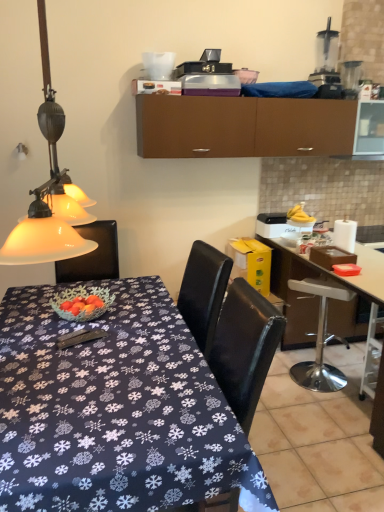
Where is `matte glass lampshade at left`? matte glass lampshade at left is located at coordinates (48, 190).

Where is `metallic silver bar stool at lower right`? The width and height of the screenshot is (384, 512). metallic silver bar stool at lower right is located at coordinates (371, 354).

Locate an element on the screen. This screenshot has height=512, width=384. dark blue fabric table at center, which is the second desk in right-to-left order is located at coordinates (115, 410).

This screenshot has height=512, width=384. What are the coordinates of `matte glass lampshade at left` in the screenshot? It's located at (48, 190).

Can you confirm if brown matte cabinet at upper center is thinner than transparent plastic blender at upper right, the 2th appliance from the right?

No.

Could you tell me if brown matte cabinet at upper center is facing transparent plastic blender at upper right, arranged as the first appliance when viewed from the left?

No, brown matte cabinet at upper center does not turn towards transparent plastic blender at upper right, arranged as the first appliance when viewed from the left.

From the image's perspective, between brown matte cabinet at upper center and transparent plastic blender at upper right, arranged as the first appliance when viewed from the left, who is located below?

From the image's view, brown matte cabinet at upper center is below.

Could transparent plastic blender at upper right, arranged as the first appliance when viewed from the left, be considered to be inside brown matte cabinet at upper center?

No, transparent plastic blender at upper right, arranged as the first appliance when viewed from the left, is not surrounded by brown matte cabinet at upper center.

What's the angular difference between matte glass lampshade at left and transparent plastic blender at upper right, arranged as the first appliance when viewed from the left,'s facing directions?

They differ by 85.1 degrees in their facing directions.

Between matte glass lampshade at left and transparent plastic blender at upper right, the 2th appliance from the right, which one appears on the right side from the viewer's perspective?

Positioned to the right is transparent plastic blender at upper right, the 2th appliance from the right.

From the image's perspective, who appears lower, matte glass lampshade at left or transparent plastic blender at upper right, the 2th appliance from the right?

matte glass lampshade at left.

Is white glossy desk at right, which is the 2th desk from left to right, looking in the opposite direction of transparent plastic blender at upper right, arranged as the first appliance when viewed from the left?

No.

How different are the orientations of white glossy desk at right, arranged as the 1th desk when viewed from the right, and transparent plastic blender at upper right, the 2th appliance from the right, in degrees?

There is a 92.4-degree angle between the facing directions of white glossy desk at right, arranged as the 1th desk when viewed from the right, and transparent plastic blender at upper right, the 2th appliance from the right.

Is white glossy desk at right, arranged as the 1th desk when viewed from the right, not near transparent plastic blender at upper right, arranged as the first appliance when viewed from the left?

Yes, white glossy desk at right, arranged as the 1th desk when viewed from the right, and transparent plastic blender at upper right, arranged as the first appliance when viewed from the left, are located far from each other.

Between white glossy desk at right, which is the 2th desk from left to right, and transparent plastic blender at upper right, the 2th appliance from the right, which one is positioned in front?

white glossy desk at right, which is the 2th desk from left to right, is in front.

From the image's perspective, between matte glass lampshade at left and brown matte cabinet at upper center, which one is located above?

brown matte cabinet at upper center.

From the picture: Is brown matte cabinet at upper center surrounded by matte glass lampshade at left?

That's incorrect, brown matte cabinet at upper center is not inside matte glass lampshade at left.

Which object is more forward, matte glass lampshade at left or brown matte cabinet at upper center?

matte glass lampshade at left is in front.

Where is `lamp in front of the brown matte cabinet at upper center`? The width and height of the screenshot is (384, 512). lamp in front of the brown matte cabinet at upper center is located at coordinates (48, 190).

Is the depth of transparent plastic blender at upper right, the second appliance viewed from the left, greater than that of white glossy desk at right, arranged as the 1th desk when viewed from the right?

Yes, it is behind white glossy desk at right, arranged as the 1th desk when viewed from the right.

At what (x,y) coordinates should I click in order to perform the action: click on the 2nd appliance behind when counting from the white glossy desk at right, arranged as the 1th desk when viewed from the right. Please return your answer as a coordinate pair (x, y). Looking at the image, I should click on (350, 78).

Between transparent plastic blender at upper right, arranged as the first appliance when viewed from the right, and white glossy desk at right, which is the 2th desk from left to right, which one appears on the right side from the viewer's perspective?

From the viewer's perspective, white glossy desk at right, which is the 2th desk from left to right, appears more on the right side.

Considering the positions of point (348, 78) and point (370, 251), is point (348, 78) closer or farther from the camera than point (370, 251)?

Point (348, 78) appears to be farther away from the viewer than point (370, 251).

Which of these two, transparent plastic blender at upper right, the 2th appliance from the right, or dark blue fabric table at center, which is the second desk in right-to-left order, is bigger?

Bigger between the two is dark blue fabric table at center, which is the second desk in right-to-left order.

From a real-world perspective, starting from the transparent plastic blender at upper right, arranged as the first appliance when viewed from the left, which desk is the 2nd one below it? Please provide its 2D coordinates.

[(115, 410)]

From a real-world perspective, is transparent plastic blender at upper right, arranged as the first appliance when viewed from the left, physically above dark blue fabric table at center, which appears as the first desk when viewed from the left?

Yes, from a real-world perspective, transparent plastic blender at upper right, arranged as the first appliance when viewed from the left, is on top of dark blue fabric table at center, which appears as the first desk when viewed from the left.

Which point is more distant from viewer, [329,89] or [135,340]?

The point [329,89] is farther.

At what (x,y) coordinates should I click in order to perform the action: click on appliance that is the 2nd one when counting backward from the white plastic chair at right. Please return your answer as a coordinate pair (x, y). Looking at the image, I should click on (350, 78).

Is transparent plastic blender at upper right, arranged as the first appliance when viewed from the right, not within white plastic chair at right?

Yes.

Looking at this image, how distant is transparent plastic blender at upper right, the second appliance viewed from the left, from white plastic chair at right?

The distance of transparent plastic blender at upper right, the second appliance viewed from the left, from white plastic chair at right is 6.04 feet.

Is transparent plastic blender at upper right, arranged as the first appliance when viewed from the right, taller than white plastic chair at right?

Incorrect, the height of transparent plastic blender at upper right, arranged as the first appliance when viewed from the right, is not larger of that of white plastic chair at right.

Locate an element on the screen. Image resolution: width=384 pixels, height=512 pixels. the 2nd appliance positioned above the brown matte cabinet at upper center (from the image's perspective) is located at coordinates (326, 64).

Where is `lamp below the transparent plastic blender at upper right, the 2th appliance from the right (from the image's perspective)`? Image resolution: width=384 pixels, height=512 pixels. lamp below the transparent plastic blender at upper right, the 2th appliance from the right (from the image's perspective) is located at coordinates (48, 190).

Looking at this image, from the image, which object appears to be farther from matte glass lampshade at left, white glossy desk at right, arranged as the 1th desk when viewed from the right, or brown matte cabinet at upper center?

white glossy desk at right, arranged as the 1th desk when viewed from the right, is further to matte glass lampshade at left.

From the image, which object appears to be farther from dark blue fabric table at center, which is the second desk in right-to-left order, white plastic chair at right or transparent plastic blender at upper right, the second appliance viewed from the left?

The object further to dark blue fabric table at center, which is the second desk in right-to-left order, is transparent plastic blender at upper right, the second appliance viewed from the left.

Based on their spatial positions, is dark blue fabric table at center, which is the second desk in right-to-left order, or matte glass lampshade at left further from white plastic chair at right?

matte glass lampshade at left is further to white plastic chair at right.

Which object lies further to the anchor point transparent plastic blender at upper right, arranged as the first appliance when viewed from the right, transparent plastic blender at upper right, arranged as the first appliance when viewed from the left, or metallic silver bar stool at lower right?

Based on the image, metallic silver bar stool at lower right appears to be further to transparent plastic blender at upper right, arranged as the first appliance when viewed from the right.

From the image, which object appears to be nearer to white glossy desk at right, arranged as the 1th desk when viewed from the right, metallic silver bar stool at lower right or transparent plastic blender at upper right, the second appliance viewed from the left?

metallic silver bar stool at lower right is positioned closer to the anchor white glossy desk at right, arranged as the 1th desk when viewed from the right.

Considering their positions, is matte glass lampshade at left positioned closer to metallic silver bar stool at lower right than brown matte cabinet at upper center?

The object closer to metallic silver bar stool at lower right is brown matte cabinet at upper center.

Considering their positions, is metallic silver bar stool at lower right positioned further to dark blue fabric table at center, which appears as the first desk when viewed from the left, than brown matte cabinet at upper center?

Based on the image, metallic silver bar stool at lower right appears to be further to dark blue fabric table at center, which appears as the first desk when viewed from the left.

Looking at the image, which one is located further to dark blue fabric table at center, which is the second desk in right-to-left order, white plastic chair at right or brown matte cabinet at upper center?

white plastic chair at right lies further to dark blue fabric table at center, which is the second desk in right-to-left order, than the other object.

Identify the location of bar stool between dark blue fabric table at center, which appears as the first desk when viewed from the left, and brown matte cabinet at upper center, along the z-axis. The height and width of the screenshot is (512, 384). (371, 354).

The image size is (384, 512). What are the coordinates of `desk between transparent plastic blender at upper right, arranged as the first appliance when viewed from the right, and metallic silver bar stool at lower right vertically` in the screenshot? It's located at (350, 276).

At what (x,y) coordinates should I click in order to perform the action: click on chair between matte glass lampshade at left and white glossy desk at right, arranged as the 1th desk when viewed from the right, in the horizontal direction. Please return your answer as a coordinate pair (x, y). Looking at the image, I should click on (320, 337).

Identify the location of desk between matte glass lampshade at left and metallic silver bar stool at lower right in the horizontal direction. (115, 410).